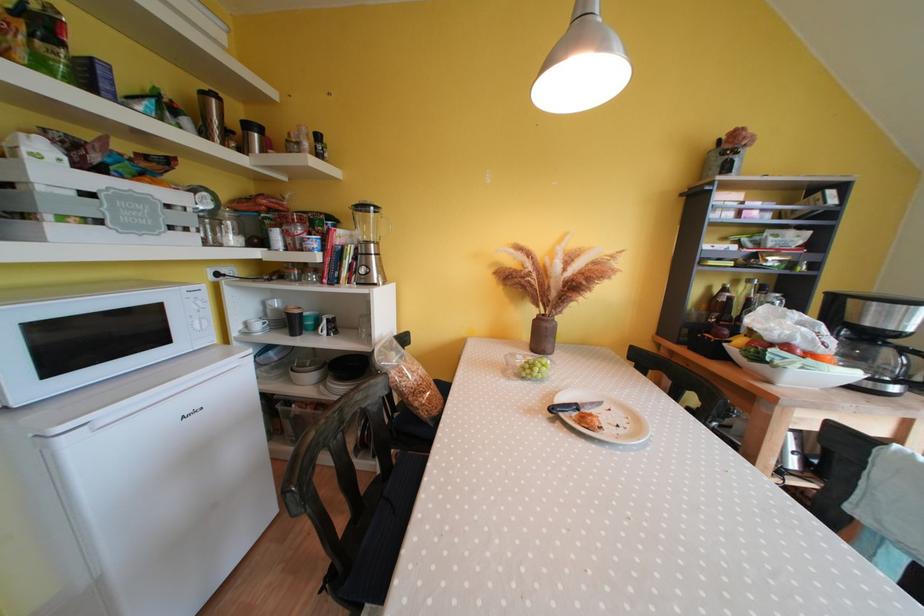
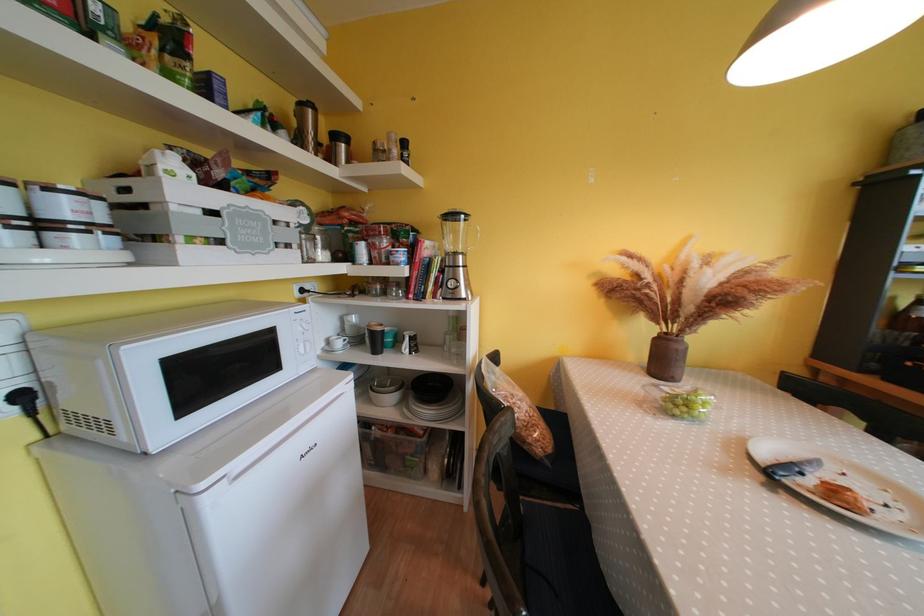
In the second image, find the point that corresponds to (296,318) in the first image.

(379, 337)